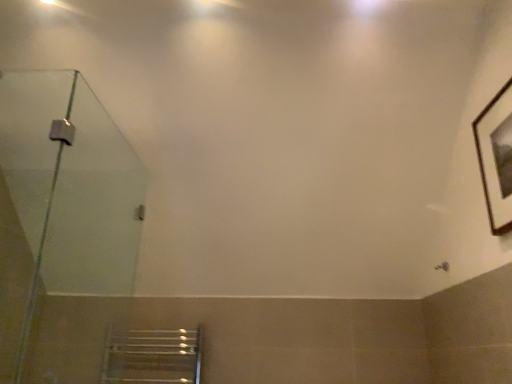
Describe the element at coordinates (494, 158) in the screenshot. I see `brown wooden picture frame at upper right` at that location.

The height and width of the screenshot is (384, 512). I want to click on brown wooden picture frame at upper right, so click(494, 158).

Locate an element on the screen. The image size is (512, 384). transparent glass shower door at left is located at coordinates (60, 204).

The height and width of the screenshot is (384, 512). Describe the element at coordinates (60, 204) in the screenshot. I see `transparent glass shower door at left` at that location.

At what (x,y) coordinates should I click in order to perform the action: click on brown wooden picture frame at upper right. Please return your answer as a coordinate pair (x, y). Looking at the image, I should click on (494, 158).

Which is more to the right, brown wooden picture frame at upper right or transparent glass shower door at left?

brown wooden picture frame at upper right.

Is the position of brown wooden picture frame at upper right more distant than that of transparent glass shower door at left?

Yes, brown wooden picture frame at upper right is behind transparent glass shower door at left.

Is point (496, 214) positioned behind point (32, 140)?

No, (496, 214) is closer to viewer.

From the image's perspective, who appears lower, brown wooden picture frame at upper right or transparent glass shower door at left?

transparent glass shower door at left is shown below in the image.

From the picture: From a real-world perspective, is brown wooden picture frame at upper right positioned above or below transparent glass shower door at left?

brown wooden picture frame at upper right is situated higher than transparent glass shower door at left in the real world.

Looking at this image, considering the sizes of objects brown wooden picture frame at upper right and transparent glass shower door at left in the image provided, who is thinner, brown wooden picture frame at upper right or transparent glass shower door at left?

brown wooden picture frame at upper right is thinner.

Is brown wooden picture frame at upper right shorter than transparent glass shower door at left?

Yes, brown wooden picture frame at upper right is shorter than transparent glass shower door at left.

Between brown wooden picture frame at upper right and transparent glass shower door at left, which one has larger size?

With larger size is transparent glass shower door at left.

Is brown wooden picture frame at upper right positioned beyond the bounds of transparent glass shower door at left?

Yes, brown wooden picture frame at upper right is not within transparent glass shower door at left.

Are brown wooden picture frame at upper right and transparent glass shower door at left making contact?

No, brown wooden picture frame at upper right is not touching transparent glass shower door at left.

In the scene shown: Is brown wooden picture frame at upper right turned away from transparent glass shower door at left?

No, brown wooden picture frame at upper right is not facing the opposite direction of transparent glass shower door at left.

How different are the orientations of brown wooden picture frame at upper right and transparent glass shower door at left in degrees?

There is a 1.6-degree angle between the facing directions of brown wooden picture frame at upper right and transparent glass shower door at left.

How far apart are brown wooden picture frame at upper right and transparent glass shower door at left?

A distance of 2.04 meters exists between brown wooden picture frame at upper right and transparent glass shower door at left.

This screenshot has width=512, height=384. In the image, there is a transparent glass shower door at left. Identify the location of picture frame above it (from the image's perspective). (494, 158).

Is transparent glass shower door at left at the right side of brown wooden picture frame at upper right?

In fact, transparent glass shower door at left is to the left of brown wooden picture frame at upper right.

Consider the image. Is the depth of transparent glass shower door at left greater than that of brown wooden picture frame at upper right?

No.

Which is less distant, (28, 118) or (487, 126)?

Point (28, 118).

From the image's perspective, which one is positioned higher, transparent glass shower door at left or brown wooden picture frame at upper right?

brown wooden picture frame at upper right is shown above in the image.

From a real-world perspective, which is physically below, transparent glass shower door at left or brown wooden picture frame at upper right?

In real-world perspective, transparent glass shower door at left is lower.

Is transparent glass shower door at left wider or thinner than brown wooden picture frame at upper right?

transparent glass shower door at left is wider than brown wooden picture frame at upper right.

Can you confirm if transparent glass shower door at left is shorter than brown wooden picture frame at upper right?

Incorrect, the height of transparent glass shower door at left does not fall short of that of brown wooden picture frame at upper right.

Who is smaller, transparent glass shower door at left or brown wooden picture frame at upper right?

brown wooden picture frame at upper right.

Is transparent glass shower door at left not within brown wooden picture frame at upper right?

transparent glass shower door at left is positioned outside brown wooden picture frame at upper right.

Is transparent glass shower door at left in contact with brown wooden picture frame at upper right?

transparent glass shower door at left and brown wooden picture frame at upper right are clearly separated.

Could you tell me if transparent glass shower door at left is turned towards brown wooden picture frame at upper right?

No, transparent glass shower door at left is not facing towards brown wooden picture frame at upper right.

How different are the orientations of transparent glass shower door at left and brown wooden picture frame at upper right in degrees?

The facing directions of transparent glass shower door at left and brown wooden picture frame at upper right are 1.6 degrees apart.

You are a GUI agent. You are given a task and a screenshot of the screen. Output one action in this format:
    pyautogui.click(x=<x>, y=<y>)
    Task: Click on the shower door that appears below the brown wooden picture frame at upper right (from the image's perspective)
    The height and width of the screenshot is (384, 512).
    Given the screenshot: What is the action you would take?
    pyautogui.click(x=60, y=204)

Identify the location of picture frame that appears above the transparent glass shower door at left (from the image's perspective). (494, 158).

Locate an element on the screen. The width and height of the screenshot is (512, 384). shower door lying in front of the brown wooden picture frame at upper right is located at coordinates (60, 204).